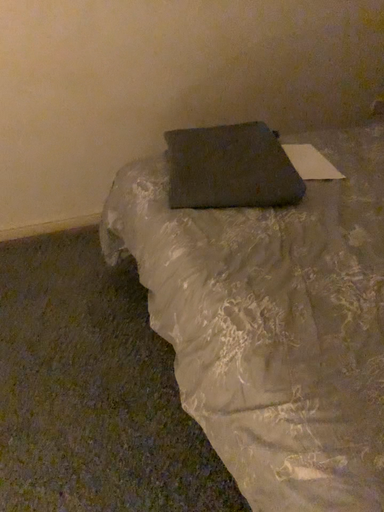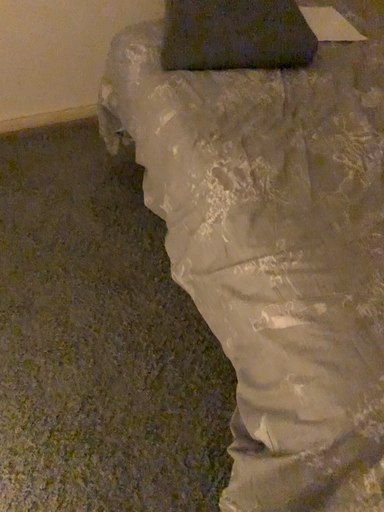
Question: How did the camera likely rotate when shooting the video?

Choices:
 (A) rotated upward
 (B) rotated downward

Answer: (B)